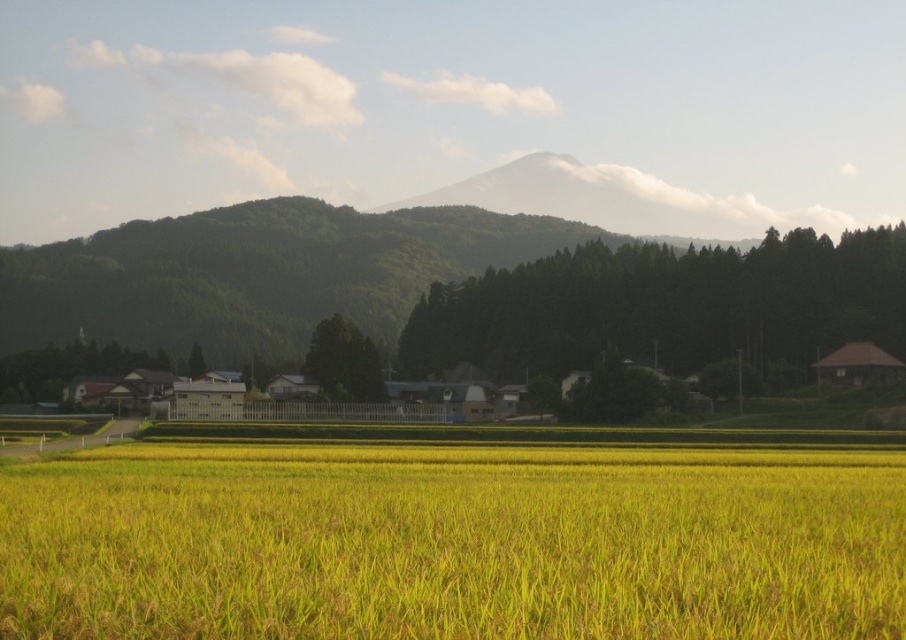
You are a farmer planning to plant new crops in the field. You see the yellow grass at center and the brown wooden hut at right in the image. Which area should you avoid planting near to prevent obstruction?

You should avoid planting near the brown wooden hut at right because the yellow grass at center is bigger and might obstruct the hut if allowed to grow unchecked.

You are a farmer who wants to check the height of the yellow grass at center and the brown wooden hut at right in the image. Which one is taller?

The yellow grass at center is taller than the brown wooden hut at right.